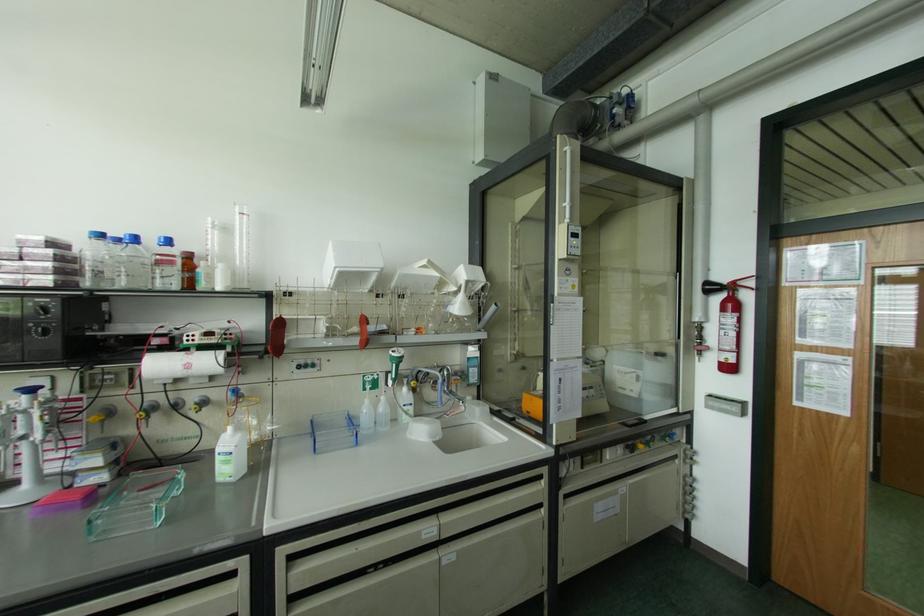
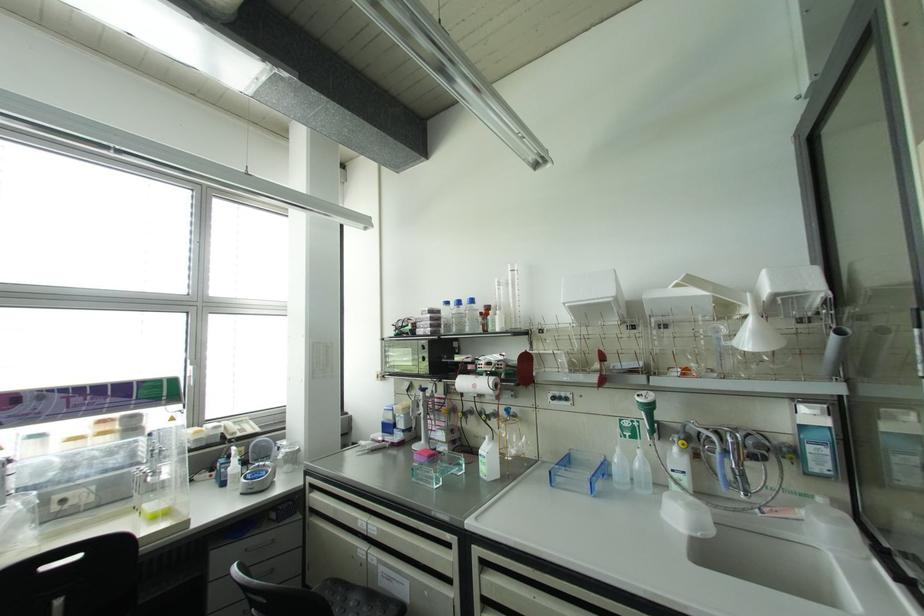
The point at (394, 379) is marked in the first image. Where is the corresponding point in the second image?

(650, 432)